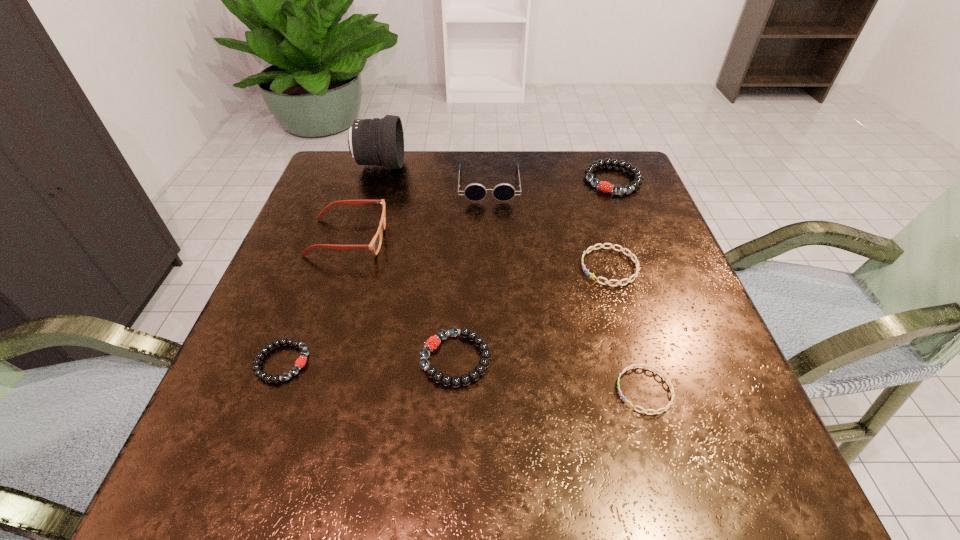
You are a GUI agent. You are given a task and a screenshot of the screen. Output one action in this format:
    pyautogui.click(x=<x>, y=<y>)
    Task: Click on the free space between the leftmost black bracelet and the biggest black bracelet
    The image size is (960, 540).
    Given the screenshot: What is the action you would take?
    pyautogui.click(x=447, y=271)

At what (x,y) coordinates should I click in order to perform the action: click on vacant area that lies between the biggest black bracelet and the second bracelet from left to right. Please return your answer as a coordinate pair (x, y). The width and height of the screenshot is (960, 540). Looking at the image, I should click on (534, 269).

Locate an element on the screen. The height and width of the screenshot is (540, 960). empty location between the second farthest bracelet and the telephoto lens is located at coordinates (494, 216).

Where is `vacant area between the rightmost black bracelet and the shortest object`? vacant area between the rightmost black bracelet and the shortest object is located at coordinates (629, 285).

Identify the location of vacant area that lies between the smallest black bracelet and the farther blue bracelet. (445, 315).

Find the location of a particular element. free space between the bigger blue bracelet and the nearer blue bracelet is located at coordinates coord(627,328).

You are a GUI agent. You are given a task and a screenshot of the screen. Output one action in this format:
    pyautogui.click(x=<x>, y=<y>)
    Task: Click on the unoccupied area between the farther blue bracelet and the farthest black bracelet
    
    Given the screenshot: What is the action you would take?
    pyautogui.click(x=612, y=224)

In order to click on vacant point located between the black telephoto lens and the farthest bracelet in this screenshot , I will do `click(496, 173)`.

The height and width of the screenshot is (540, 960). I want to click on free area in between the fourth tallest object and the farther blue bracelet, so click(612, 224).

This screenshot has width=960, height=540. I want to click on object that can be found as the fourth closest to the telephoto lens, so click(x=636, y=261).